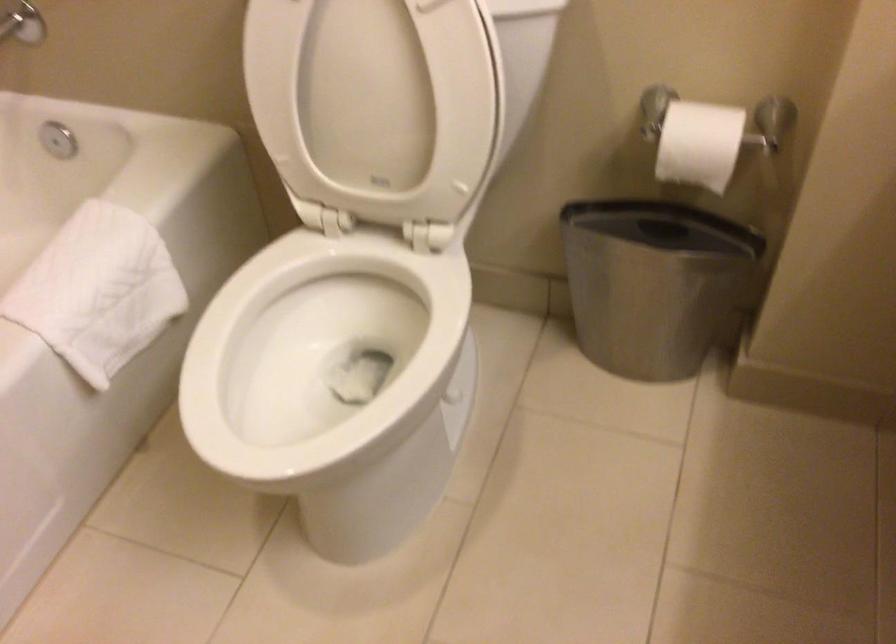
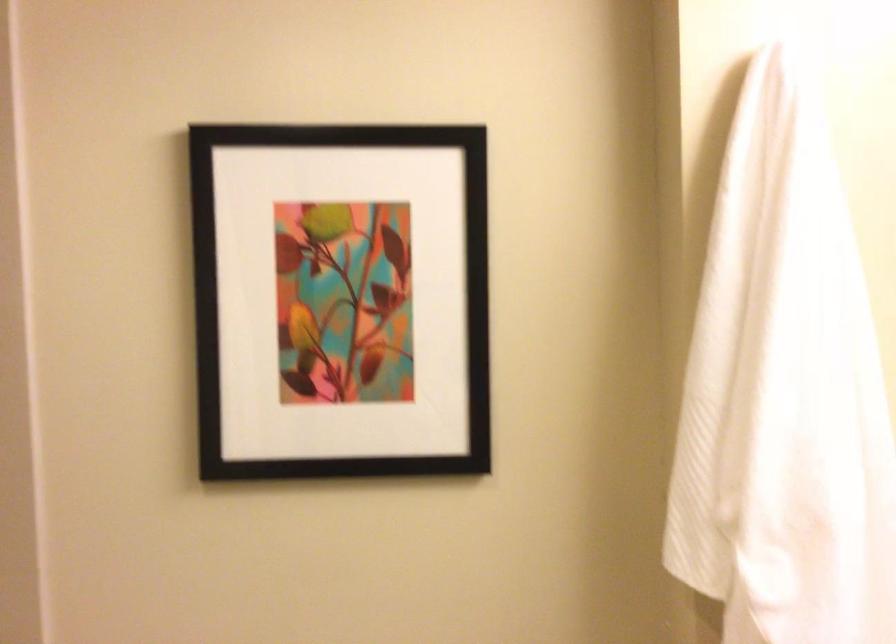
The first image is from the beginning of the video and the second image is from the end. How did the camera likely rotate when shooting the video?

The rotation direction of the camera is right-up.